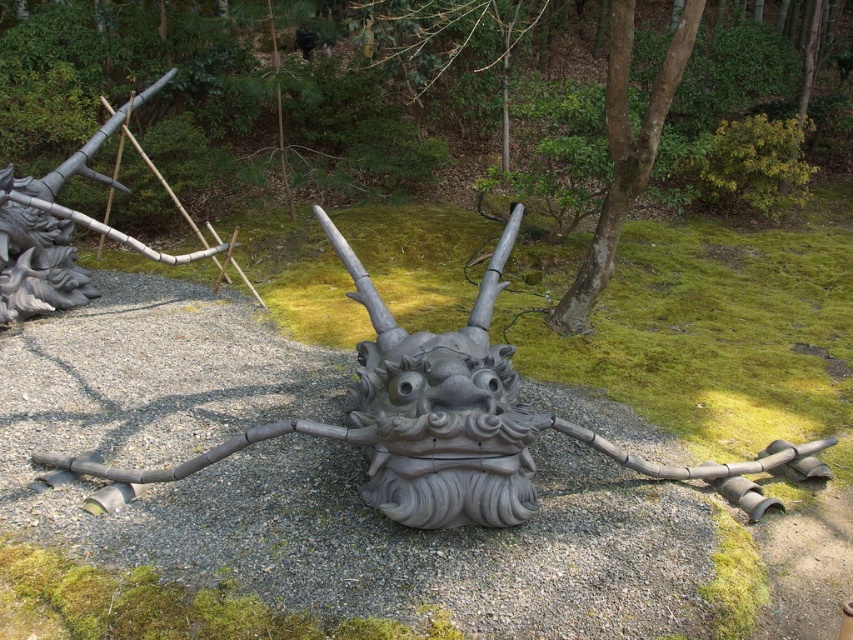
You are standing in the garden and want to place a 15 feet long decorative banner between you and the brushed metal dragon head at left. Is there enough space to stretch the banner fully without folding it?

The distance between you and the brushed metal dragon head at left is 18.75 feet, which is greater than the banner length of 15 feet. Therefore, there is enough space to stretch the banner fully without folding it.

You are a visitor in this garden and want to take a photo of both the brushed metal dragon head at left and the brown smooth tree at center. Since you want both to be fully visible in the frame, which object should you position closer to the camera?

The brushed metal dragon head at left is taller than the brown smooth tree at center, so you should position the brown smooth tree at center closer to the camera to ensure both are fully visible in the frame.

You are a visitor in the garden and want to take a photo of both the brushed metal dragon head at left and the brown smooth tree at center. Which object should you focus on first to ensure both are in the frame?

You should focus on the brushed metal dragon head at left first because it is closer to you than the brown smooth tree at center, so adjusting the camera to include both would require ensuring the closer object is framed first.